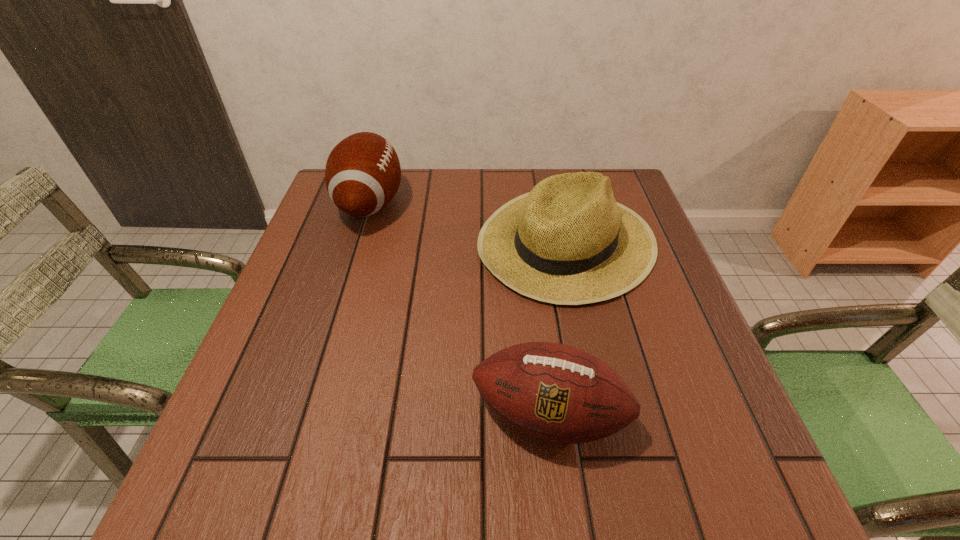
Image resolution: width=960 pixels, height=540 pixels. Find the location of `the second closest object relative to the right football (American)`. the second closest object relative to the right football (American) is located at coordinates (362, 175).

Locate which object is the second closest to the nearer football (American). Please provide its 2D coordinates. Your answer should be formatted as a tuple, i.e. [(x, y)], where the tuple contains the x and y coordinates of a point satisfying the conditions above.

[(362, 175)]

Identify the location of blank area in the image that satisfies the following two spatial constraints: 1. on the back side of the sunhat; 2. on the laces of the left football (American). This screenshot has height=540, width=960. (558, 204).

Find the location of a particular element. blank space that satisfies the following two spatial constraints: 1. on the laces of the tallest object; 2. on the back side of the sunhat is located at coordinates (359, 241).

Locate an element on the screen. The width and height of the screenshot is (960, 540). vacant space that satisfies the following two spatial constraints: 1. on the laces of the leftmost object; 2. on the right side of the right football (American) is located at coordinates (304, 415).

Locate an element on the screen. The width and height of the screenshot is (960, 540). blank area in the image that satisfies the following two spatial constraints: 1. on the laces of the right football (American); 2. on the left side of the taller football (American) is located at coordinates (304, 415).

Identify the location of free spot that satisfies the following two spatial constraints: 1. on the laces of the farther football (American); 2. on the right side of the sunhat. (359, 241).

Locate an element on the screen. free point that satisfies the following two spatial constraints: 1. on the back side of the sunhat; 2. on the laces of the taller football (American) is located at coordinates (558, 204).

Where is `blank space that satisfies the following two spatial constraints: 1. on the back side of the right football (American); 2. on the laces of the farther football (American)`? The height and width of the screenshot is (540, 960). blank space that satisfies the following two spatial constraints: 1. on the back side of the right football (American); 2. on the laces of the farther football (American) is located at coordinates (523, 204).

Where is `free space that satisfies the following two spatial constraints: 1. on the laces of the taller football (American); 2. on the right side of the sunhat`? The height and width of the screenshot is (540, 960). free space that satisfies the following two spatial constraints: 1. on the laces of the taller football (American); 2. on the right side of the sunhat is located at coordinates (359, 241).